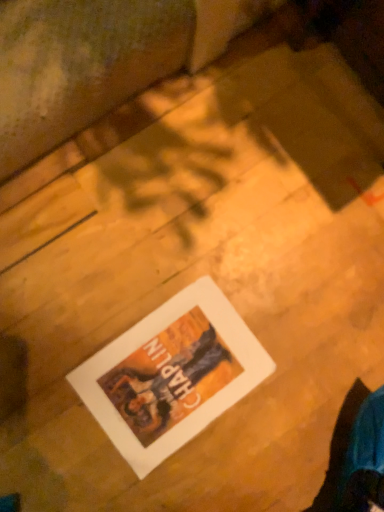
Where is `vacant area on top of matte paper poster at center (from a real-world perspective)`? Image resolution: width=384 pixels, height=512 pixels. vacant area on top of matte paper poster at center (from a real-world perspective) is located at coordinates (166, 384).